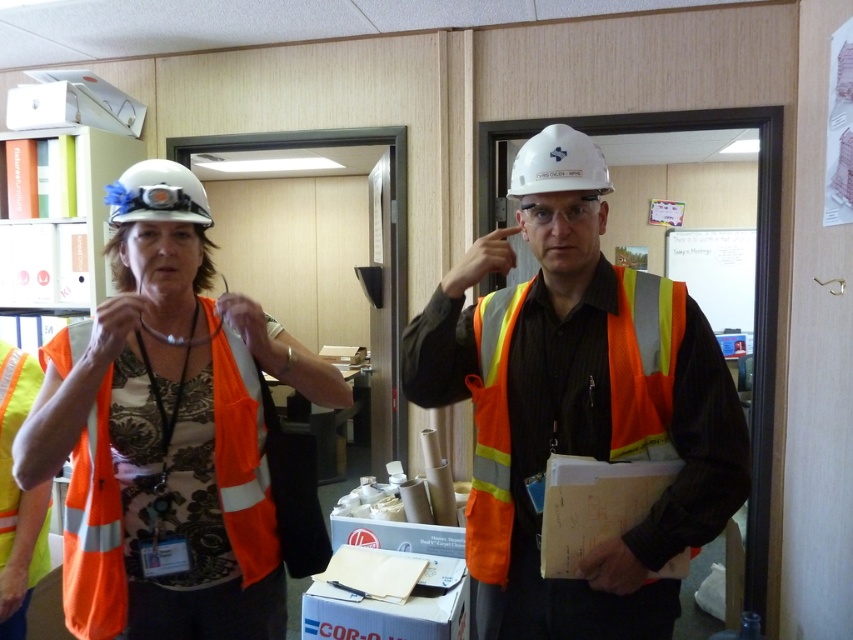
Question: Which object appears farthest from the camera in this image?

Choices:
 (A) orange reflective safety vest at center
 (B) white hard hat at upper center
 (C) white hard hat at center
 (D) matte orange safety vest at center

Answer: (B)

Question: Is matte orange safety vest at center in front of white hard hat at center?

Choices:
 (A) yes
 (B) no

Answer: (A)

Question: Does matte orange safety vest at center appear under white hard hat at center?

Choices:
 (A) yes
 (B) no

Answer: (A)

Question: Considering the real-world distances, which object is farthest from the white hard hat at upper center?

Choices:
 (A) orange reflective vest at center
 (B) matte orange safety vest at center
 (C) white hard hat at center

Answer: (B)

Question: Does matte orange safety vest at center have a smaller size compared to orange reflective safety vest at center?

Choices:
 (A) no
 (B) yes

Answer: (A)

Question: Considering the real-world distances, which object is closest to the orange reflective vest at center?

Choices:
 (A) white hard hat at center
 (B) matte orange safety vest at center
 (C) orange reflective safety vest at center
 (D) white hard hat at upper center

Answer: (D)